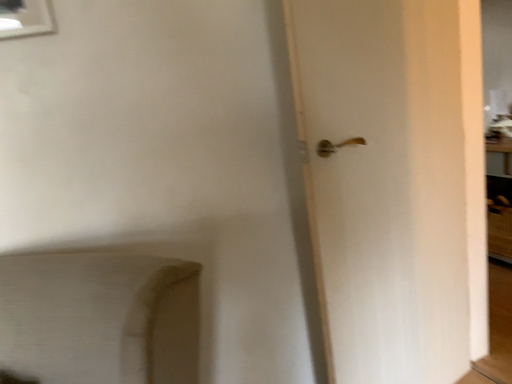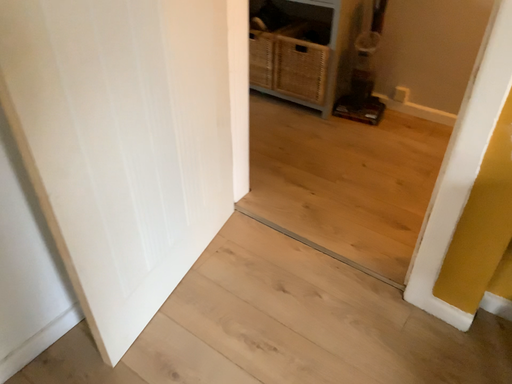
Question: How did the camera likely rotate when shooting the video?

Choices:
 (A) rotated left
 (B) rotated right

Answer: (B)